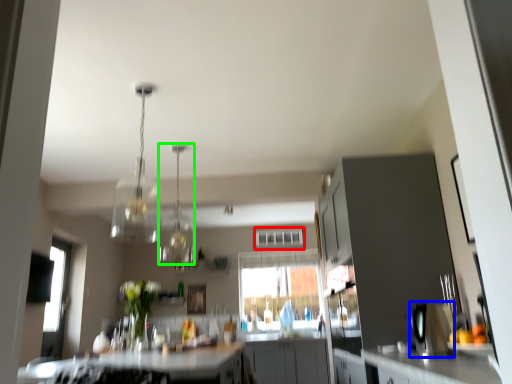
Question: Which object is positioned farthest from window (highlighted by a red box)? Select from appliance (highlighted by a blue box) and light fixture (highlighted by a green box).

Choices:
 (A) appliance
 (B) light fixture

Answer: (A)